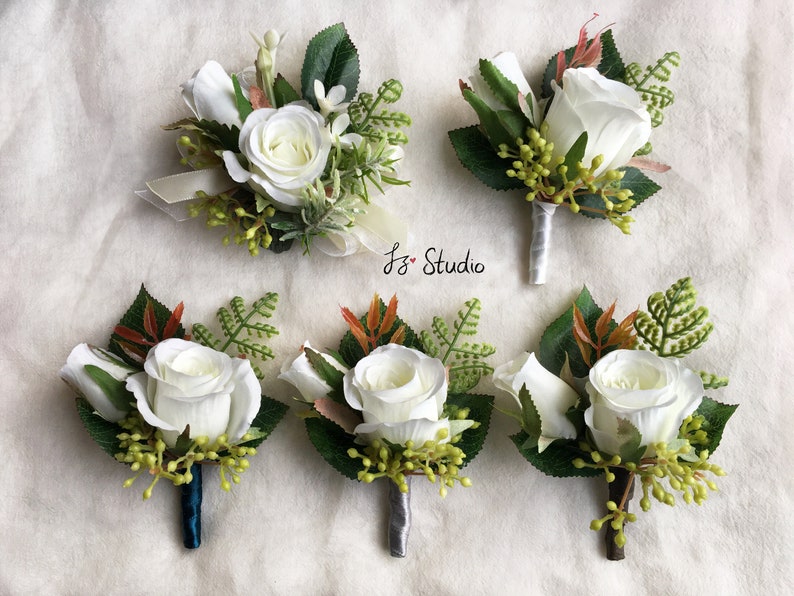
At what (x,y) coordinates should I click in order to perform the action: click on bouquet. Please return your answer as a coordinate pair (x, y). Looking at the image, I should click on (280, 235), (164, 458), (384, 465), (636, 454), (563, 184).